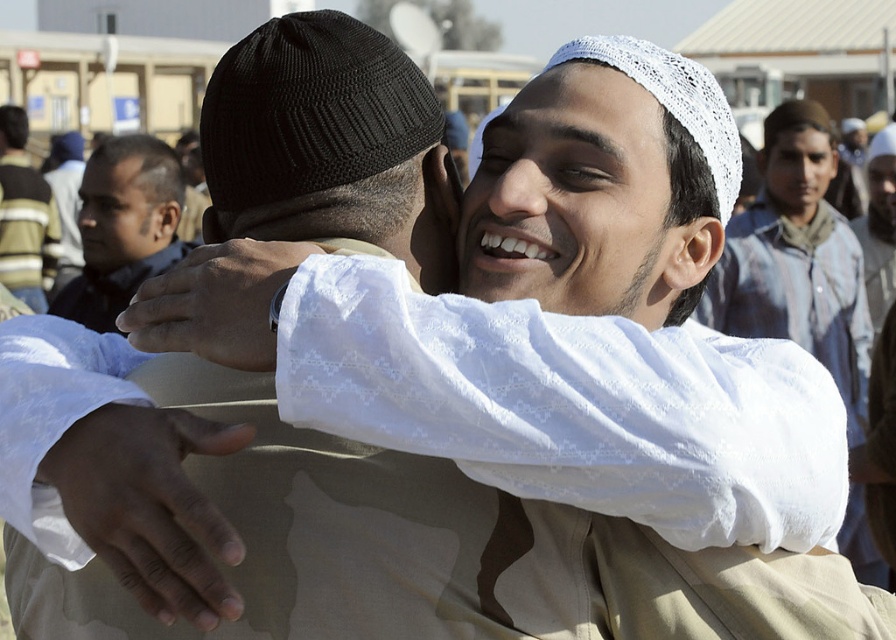
Does white lace shirt at upper center have a lesser height compared to brown leather jacket at left?

No.

Can you confirm if white lace shirt at upper center is positioned below brown leather jacket at left?

No.

Describe the element at coordinates (797, 259) in the screenshot. I see `white lace shirt at upper center` at that location.

Find the location of a particular element. white lace shirt at upper center is located at coordinates (797, 259).